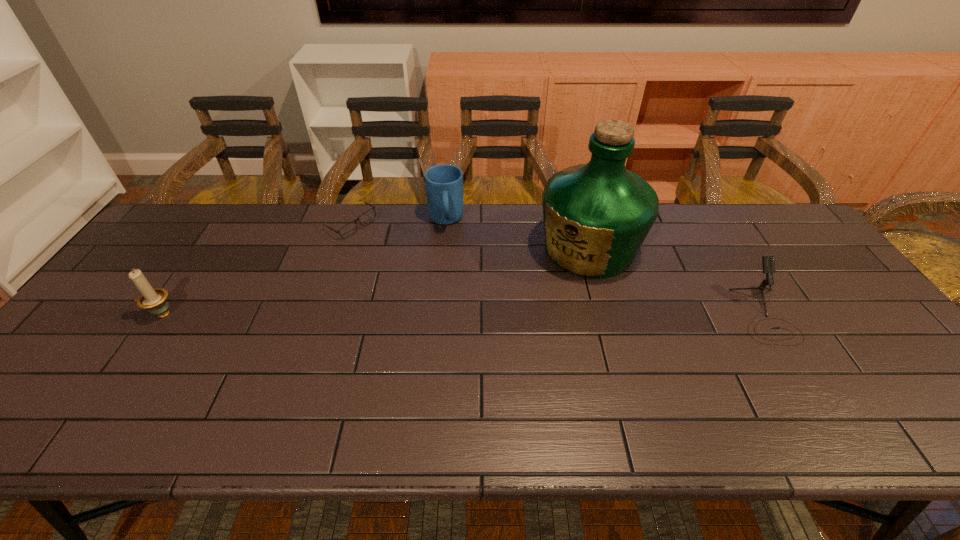
The image size is (960, 540). Identify the location of mug that is positioned at the far edge. (444, 183).

Image resolution: width=960 pixels, height=540 pixels. Identify the location of liquor that is at the far edge. (596, 215).

Image resolution: width=960 pixels, height=540 pixels. Find the location of `spectacles that is positioned at the far edge`. spectacles that is positioned at the far edge is located at coordinates (349, 229).

This screenshot has height=540, width=960. I want to click on object that is at the left edge, so click(154, 300).

You are a GUI agent. You are given a task and a screenshot of the screen. Output one action in this format:
    pyautogui.click(x=<x>, y=<y>)
    Task: Click on the free point at the far edge
    The height and width of the screenshot is (540, 960).
    Given the screenshot: What is the action you would take?
    pyautogui.click(x=665, y=207)

You are a GUI agent. You are given a task and a screenshot of the screen. Output one action in this format:
    pyautogui.click(x=<x>, y=<y>)
    Task: Click on the blank space at the near edge of the desktop
    
    Given the screenshot: What is the action you would take?
    pyautogui.click(x=384, y=378)

This screenshot has height=540, width=960. Find the location of `vacant space at the left edge`. vacant space at the left edge is located at coordinates (74, 335).

Find the location of a particular element. vacant space at the far left corner is located at coordinates (188, 208).

In the image, there is a desktop. Identify the location of vacant space at the near right corner. This screenshot has height=540, width=960. (910, 383).

Find the location of `free space between the third object from right to left and the spectacles`. free space between the third object from right to left and the spectacles is located at coordinates coord(398,222).